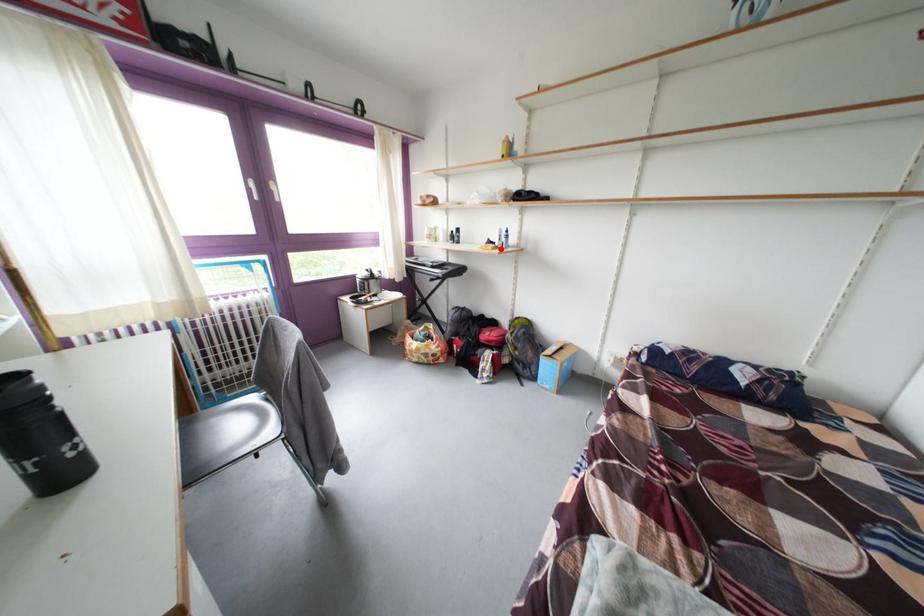
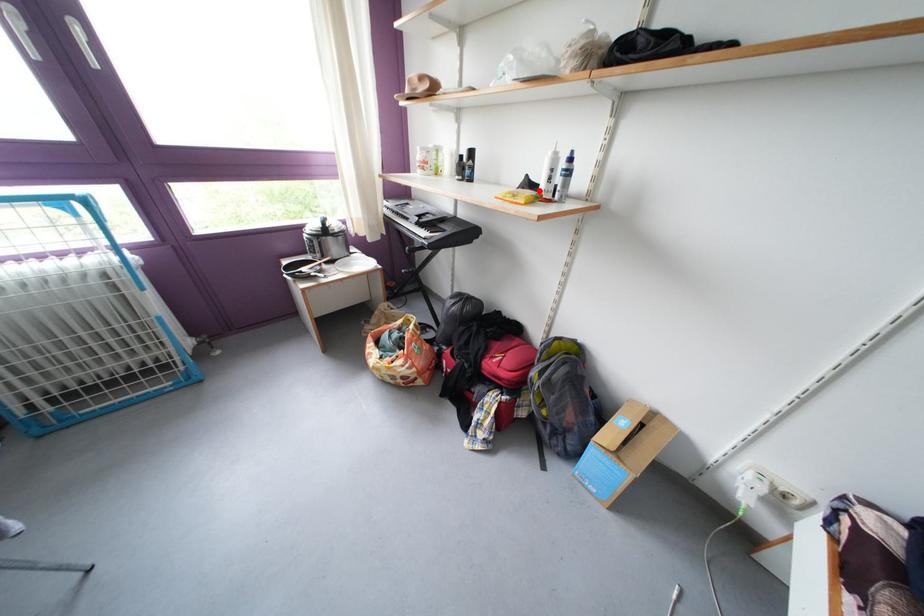
I am providing you with two images of the same scene from different viewpoints. A red point is marked on the first image and another point is marked on the second image. Is the red point in image1 aligned with the point shown in image2?

Yes